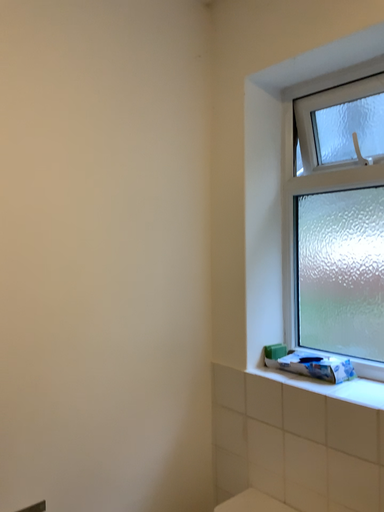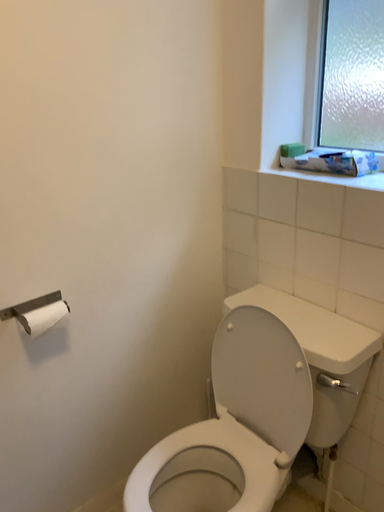
Question: How did the camera likely rotate when shooting the video?

Choices:
 (A) rotated upward
 (B) rotated downward

Answer: (B)